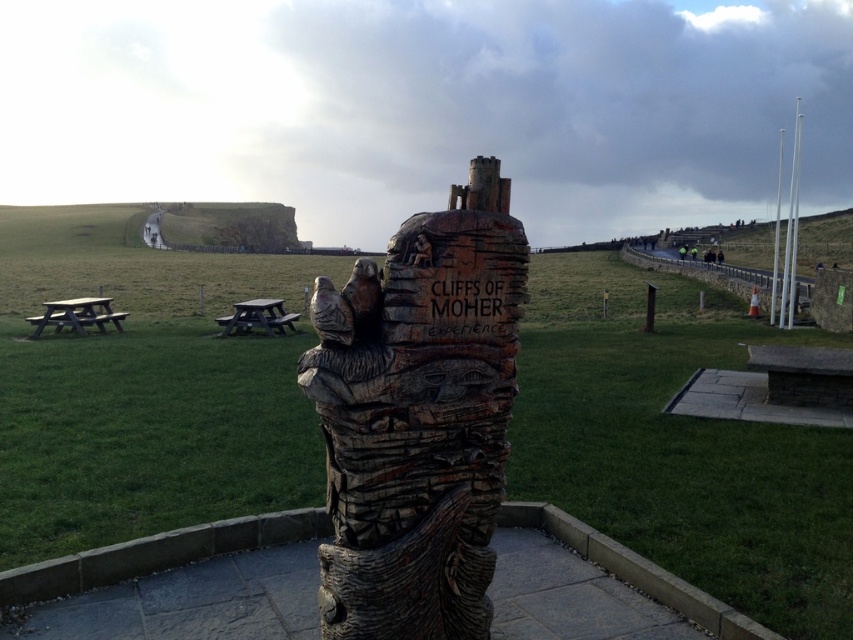
You are a tourist at the Cliffs of Moher Experience and want to take a photo of the wooden carving at center and the wooden picnic table at left. Which object should you position closer to the camera to ensure both are in the frame?

Since the wooden carving at center is to the right of the wooden picnic table at left, you should position the wooden picnic table at left closer to the camera to ensure both are in the frame.

In the scene shown: You are standing at the Cliffs of Moher Experience and want to place a small bench between the two points labeled point (352, 321) and point (94, 314). Which point should the bench be closer to in order to ensure it is positioned in the foreground of the scene?

The bench should be closer to point (94, 314) because it is behind point (352, 321), so positioning the bench near point (94, 314) would place it further back, but the question asks for the foreground. Wait, the description says point (352, 321) is in front of (94, 314). Therefore, to be in the foreground, the bench should be closer to point (352, 321).

You are a visitor at the Cliffs of Moher Experience and see both the white wood totem pole at right and the wooden totem pole at right. Which one is bigger?

The white wood totem pole at right is larger compared to the wooden totem pole at right.